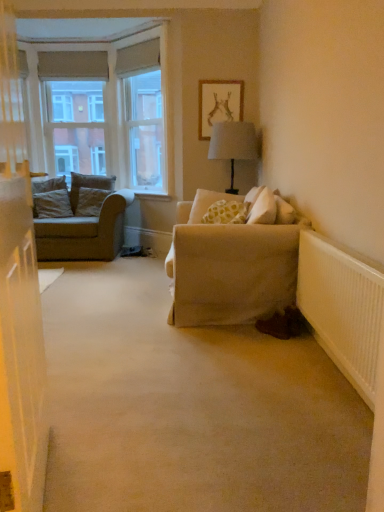
This screenshot has width=384, height=512. What are the coordinates of `free spot in front of white ribbed radiator at lower right` in the screenshot? It's located at [x=304, y=430].